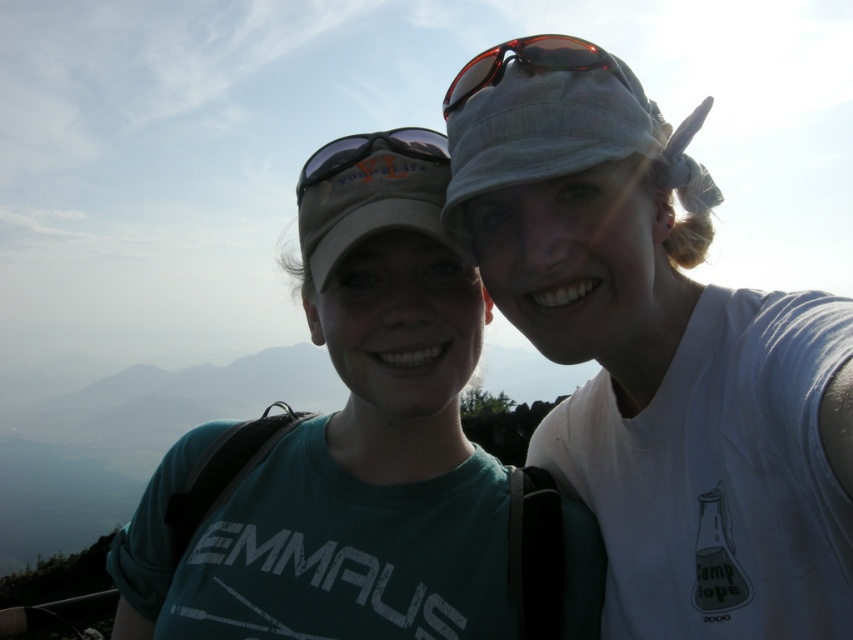
What do you see at coordinates (369, 193) in the screenshot? The image size is (853, 640). I see `matte gray baseball cap at upper center` at bounding box center [369, 193].

Is point (381, 141) farther from camera compared to point (355, 154)?

Yes.

Does point (346, 141) come closer to viewer compared to point (323, 156)?

That is True.

Locate an element on the screen. matte gray baseball cap at upper center is located at coordinates (369, 193).

Is point (334, 221) in front of point (474, 60)?

No, (334, 221) is behind (474, 60).

Does matte gray baseball cap at upper center have a lesser width compared to shiny red sunglasses at center?

No.

The height and width of the screenshot is (640, 853). What are the coordinates of `matte gray baseball cap at upper center` in the screenshot? It's located at (369, 193).

Is shiny red sunglasses at center shorter than matte gray goggles at center?

No, shiny red sunglasses at center is not shorter than matte gray goggles at center.

Is shiny red sunglasses at center thinner than matte gray goggles at center?

Correct, shiny red sunglasses at center's width is less than matte gray goggles at center's.

Measure the distance between point (448, 104) and camera.

Point (448, 104) is 4.37 meters from camera.

Identify the location of shiny red sunglasses at center. Image resolution: width=853 pixels, height=640 pixels. (524, 64).